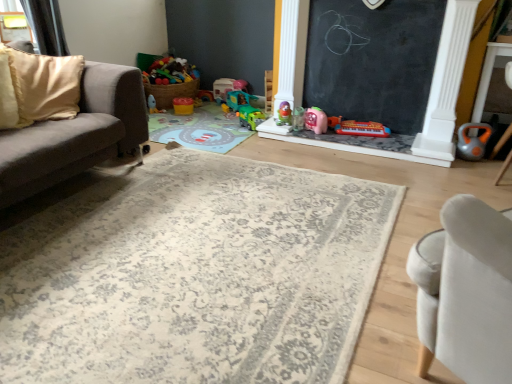
Find the location of a particular element. The height and width of the screenshot is (384, 512). vacant point to the right of yellow plastic cup at center, placed as the second toy when sorted from left to right is located at coordinates (207, 109).